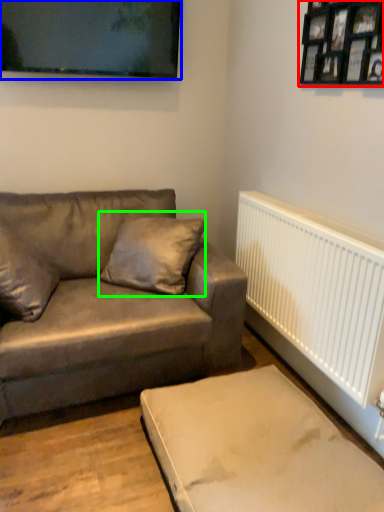
Question: Considering the real-world distances, which object is farthest from picture frame (highlighted by a red box)? picture frame (highlighted by a blue box) or pillow (highlighted by a green box)?

Choices:
 (A) picture frame
 (B) pillow

Answer: (B)